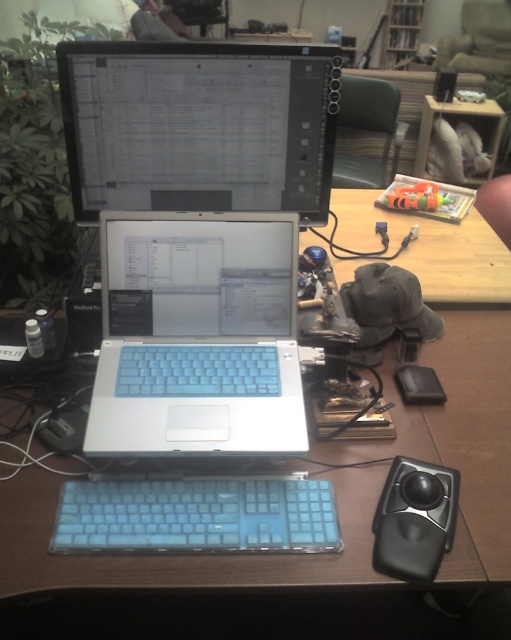
Is satin silver laptop at center smaller than translucent blue keyboard at center?

Actually, satin silver laptop at center might be larger than translucent blue keyboard at center.

Is satin silver laptop at center thinner than translucent blue keyboard at center?

No, satin silver laptop at center is not thinner than translucent blue keyboard at center.

Who is more distant from viewer, [145,380] or [205,515]?

Positioned behind is point [145,380].

Find the location of `satin silver laptop at center`. satin silver laptop at center is located at coordinates (197, 228).

Can you confirm if satin silver laptop at center is smaller than white rubberized laptop at center?

No.

Can you confirm if satin silver laptop at center is taller than white rubberized laptop at center?

Correct, satin silver laptop at center is much taller as white rubberized laptop at center.

Is point (102, 124) positioned behind point (182, 440)?

That is True.

Image resolution: width=511 pixels, height=640 pixels. Identify the location of satin silver laptop at center. (197, 228).

Can you confirm if wooden table at center is smaller than translucent blue keyboard at center?

No.

Where is `wooden table at center`? This screenshot has width=511, height=640. wooden table at center is located at coordinates (476, 426).

At what (x,y) coordinates should I click in order to perform the action: click on wooden table at center. Please return your answer as a coordinate pair (x, y). The image size is (511, 640). Looking at the image, I should click on (476, 426).